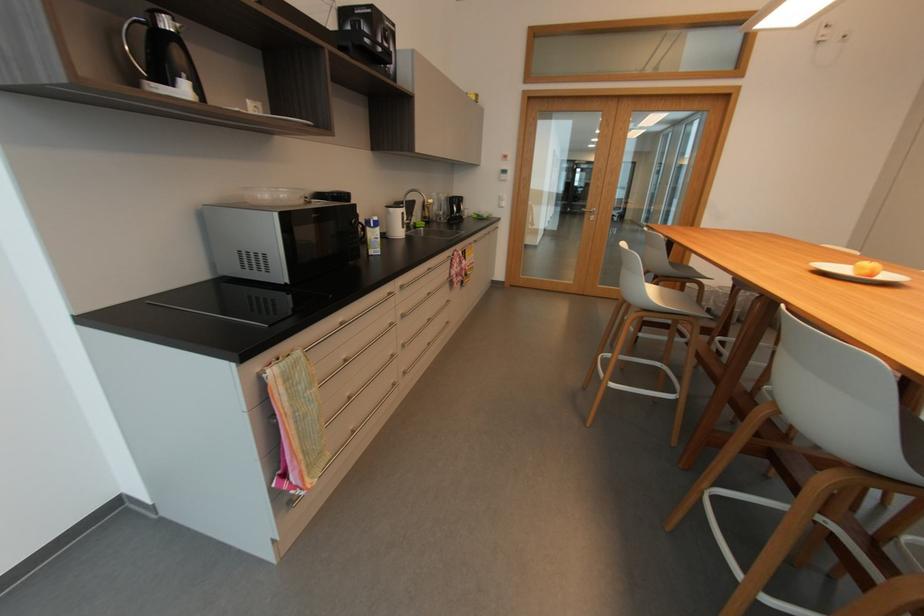
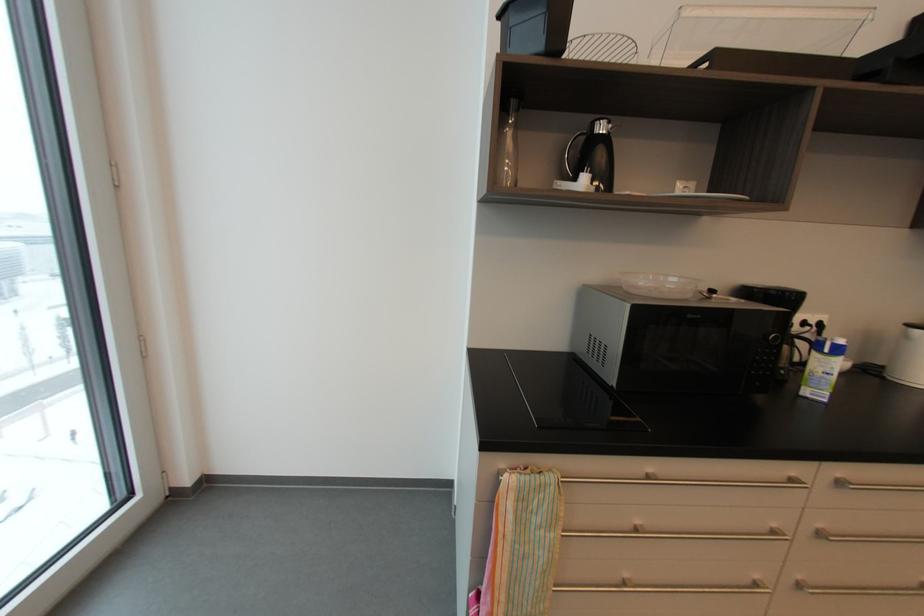
Question: Based on the continuous images, in which direction is the camera rotating? Reply with the corresponding letter.

Choices:
 (A) Left
 (B) Right
 (C) Up
 (D) Down

Answer: (A)